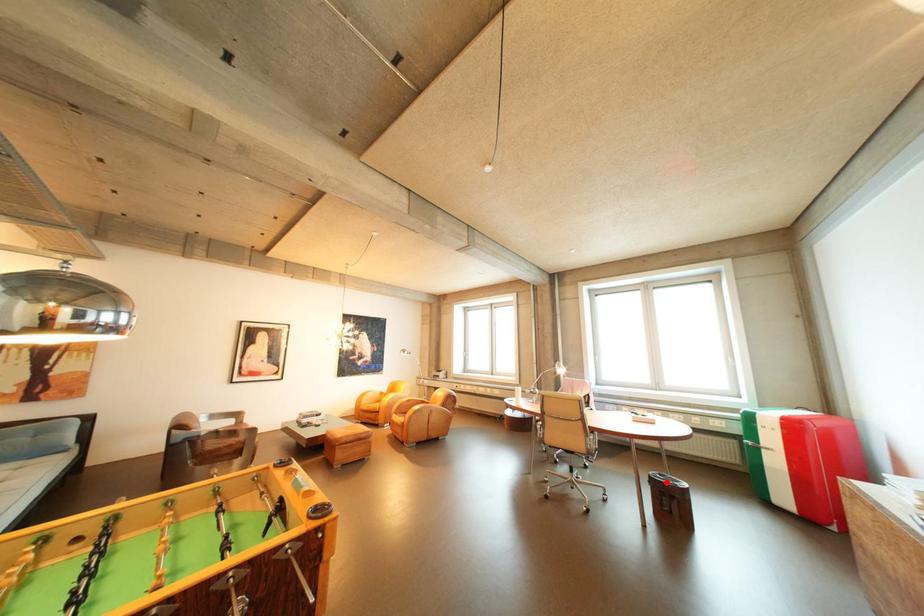
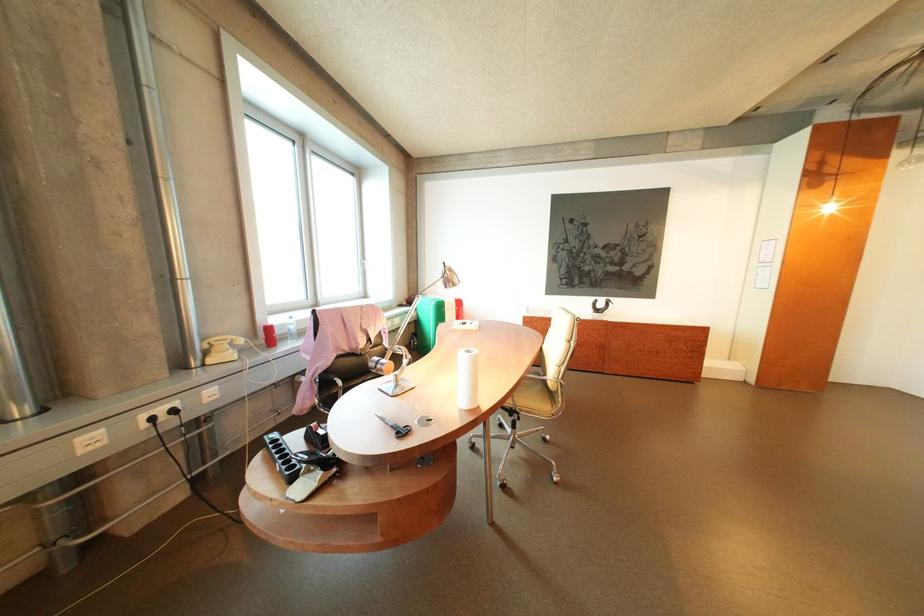
Question: I am providing you with two images of the same scene from different viewpoints. A red point is marked on the first image. At the location where the point appears in image 1, is it still visible in image 2?

Choices:
 (A) Yes
 (B) No

Answer: (B)